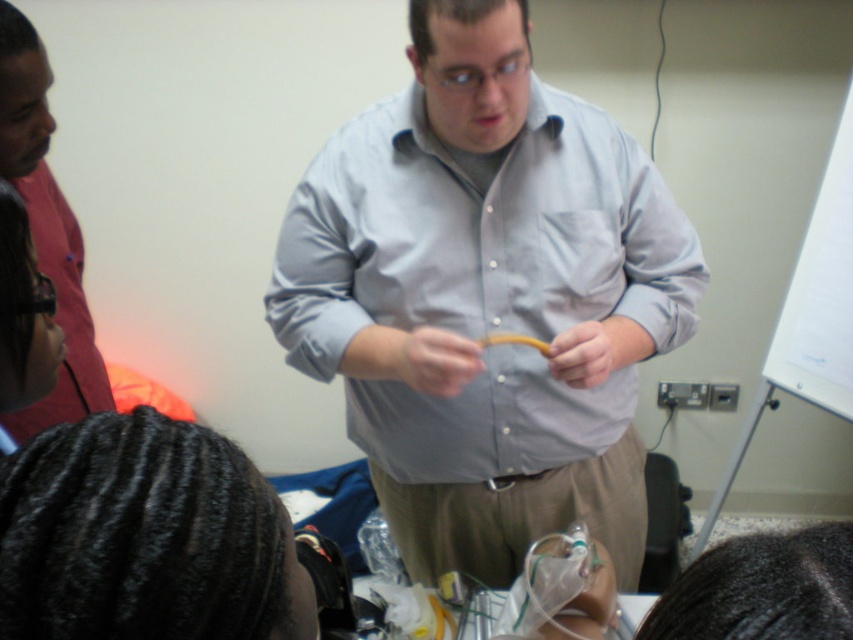
Does light blue shirt at center lie behind matte red shirt at left?

No, it is in front of matte red shirt at left.

Is light blue shirt at center to the left of matte red shirt at left from the viewer's perspective?

In fact, light blue shirt at center is to the right of matte red shirt at left.

Which is behind, point (704, 275) or point (97, 368)?

Point (97, 368)

Where is `light blue shirt at center`? The width and height of the screenshot is (853, 640). light blue shirt at center is located at coordinates (485, 294).

Where is `matte yellow ring at center`? This screenshot has width=853, height=640. matte yellow ring at center is located at coordinates (589, 353).

Is matte yellow ring at center shorter than yellow rubber tube at center?

Incorrect, matte yellow ring at center's height does not fall short of yellow rubber tube at center's.

Does point (567, 330) come farther from viewer compared to point (537, 340)?

That is True.

This screenshot has width=853, height=640. I want to click on matte yellow ring at center, so click(589, 353).

Can you confirm if matte red shirt at left is bigger than yellow rubber tube at center?

Correct, matte red shirt at left is larger in size than yellow rubber tube at center.

Who is shorter, matte red shirt at left or yellow rubber tube at center?

Standing shorter between the two is yellow rubber tube at center.

Who is more forward, (26, 100) or (524, 337)?

Point (524, 337)

At what (x,y) coordinates should I click in order to perform the action: click on matte red shirt at left. Please return your answer as a coordinate pair (x, y). The width and height of the screenshot is (853, 640). Looking at the image, I should click on (45, 225).